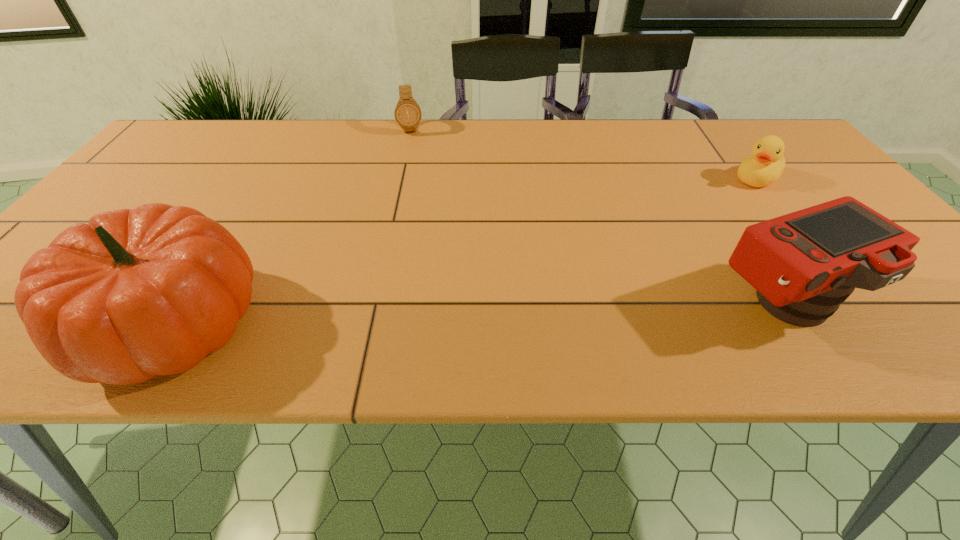
At what (x,y) coordinates should I click in order to perform the action: click on free space on the desktop that is between the pumpkin and the camera and is positioned on the face of the duckling. Please return your answer as a coordinate pair (x, y). Looking at the image, I should click on (562, 312).

Find the location of `free space on the desktop that is between the leftmost object and the camera and is positioned on the face of the farthest object`. free space on the desktop that is between the leftmost object and the camera and is positioned on the face of the farthest object is located at coordinates (429, 316).